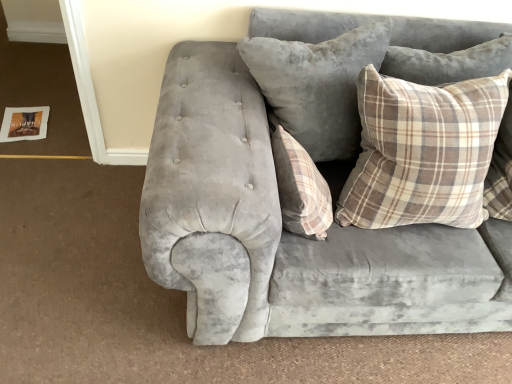
Question: Which direction should I rotate to look at plaid fabric pillow at center, marked as the 3th pillow in a right-to-left arrangement?

Choices:
 (A) right
 (B) left

Answer: (A)

Question: From the image's perspective, is velvet gray pillow at center, positioned as the second pillow in right-to-left order, beneath plaid fabric pillow at upper right, positioned as the first pillow in right-to-left order?

Choices:
 (A) no
 (B) yes

Answer: (A)

Question: Is velvet gray pillow at center, positioned as the second pillow in right-to-left order, positioned in front of plaid fabric pillow at upper right, which is the third pillow in left-to-right order?

Choices:
 (A) no
 (B) yes

Answer: (A)

Question: Is velvet gray pillow at center, which appears as the 2th pillow when viewed from the left, to the left of plaid fabric pillow at upper right, which is the third pillow in left-to-right order, from the viewer's perspective?

Choices:
 (A) no
 (B) yes

Answer: (B)

Question: Would you say velvet gray pillow at center, positioned as the second pillow in right-to-left order, contains plaid fabric pillow at upper right, positioned as the first pillow in right-to-left order?

Choices:
 (A) no
 (B) yes

Answer: (A)

Question: Is velvet gray pillow at center, positioned as the second pillow in right-to-left order, outside plaid fabric pillow at upper right, positioned as the first pillow in right-to-left order?

Choices:
 (A) yes
 (B) no

Answer: (A)

Question: Are velvet gray pillow at center, positioned as the second pillow in right-to-left order, and plaid fabric pillow at upper right, positioned as the first pillow in right-to-left order, located far from each other?

Choices:
 (A) yes
 (B) no

Answer: (B)

Question: Is plaid fabric pillow at center, marked as the 3th pillow in a right-to-left arrangement, to the right of velvet gray pillow at center, which appears as the 2th pillow when viewed from the left, from the viewer's perspective?

Choices:
 (A) yes
 (B) no

Answer: (B)

Question: From the image's perspective, is plaid fabric pillow at center, acting as the 1th pillow starting from the left, over velvet gray pillow at center, positioned as the second pillow in right-to-left order?

Choices:
 (A) yes
 (B) no

Answer: (B)

Question: Is plaid fabric pillow at center, acting as the 1th pillow starting from the left, completely or partially outside of velvet gray pillow at center, which appears as the 2th pillow when viewed from the left?

Choices:
 (A) yes
 (B) no

Answer: (A)

Question: Is plaid fabric pillow at center, marked as the 3th pillow in a right-to-left arrangement, with velvet gray pillow at center, which appears as the 2th pillow when viewed from the left?

Choices:
 (A) no
 (B) yes

Answer: (A)

Question: Considering the relative sizes of plaid fabric pillow at center, marked as the 3th pillow in a right-to-left arrangement, and velvet gray pillow at center, which appears as the 2th pillow when viewed from the left, in the image provided, is plaid fabric pillow at center, marked as the 3th pillow in a right-to-left arrangement, shorter than velvet gray pillow at center, which appears as the 2th pillow when viewed from the left,?

Choices:
 (A) yes
 (B) no

Answer: (A)

Question: Is plaid fabric pillow at center, marked as the 3th pillow in a right-to-left arrangement, turned away from velvet gray pillow at center, positioned as the second pillow in right-to-left order?

Choices:
 (A) yes
 (B) no

Answer: (B)

Question: From the image's perspective, is plaid fabric pillow at upper right, which is the third pillow in left-to-right order, over velvet gray pillow at center, positioned as the second pillow in right-to-left order?

Choices:
 (A) yes
 (B) no

Answer: (B)